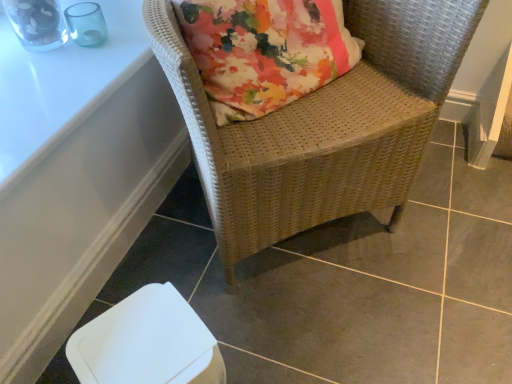
Question: Can you confirm if white plastic table at lower left, the 2th table when ordered from top to bottom, is wider than white glossy table at upper left, arranged as the first table when viewed from the top?

Choices:
 (A) no
 (B) yes

Answer: (A)

Question: Is white plastic table at lower left, positioned as the first table in bottom-to-top order, behind white glossy table at upper left, arranged as the first table when viewed from the top?

Choices:
 (A) yes
 (B) no

Answer: (A)

Question: Is white plastic table at lower left, positioned as the first table in bottom-to-top order, at the left side of white glossy table at upper left, arranged as the first table when viewed from the top?

Choices:
 (A) yes
 (B) no

Answer: (B)

Question: Is white plastic table at lower left, the 2th table when ordered from top to bottom, looking in the opposite direction of white glossy table at upper left, arranged as the first table when viewed from the top?

Choices:
 (A) yes
 (B) no

Answer: (B)

Question: Is white glossy table at upper left, arranged as the first table when viewed from the top, located within white plastic table at lower left, the 2th table when ordered from top to bottom?

Choices:
 (A) no
 (B) yes

Answer: (A)

Question: Considering the relative sizes of white plastic table at lower left, positioned as the first table in bottom-to-top order, and white glossy table at upper left, arranged as the first table when viewed from the top, in the image provided, is white plastic table at lower left, positioned as the first table in bottom-to-top order, bigger than white glossy table at upper left, arranged as the first table when viewed from the top,?

Choices:
 (A) yes
 (B) no

Answer: (B)

Question: Can you confirm if white plastic table at lower left, the 2th table when ordered from top to bottom, is shorter than white plastic swivel chair at lower left?

Choices:
 (A) no
 (B) yes

Answer: (B)

Question: Considering the relative sizes of white plastic table at lower left, the 2th table when ordered from top to bottom, and white plastic swivel chair at lower left in the image provided, is white plastic table at lower left, the 2th table when ordered from top to bottom, thinner than white plastic swivel chair at lower left?

Choices:
 (A) no
 (B) yes

Answer: (B)

Question: Is white plastic table at lower left, the 2th table when ordered from top to bottom, positioned far away from white plastic swivel chair at lower left?

Choices:
 (A) no
 (B) yes

Answer: (A)

Question: Considering the relative sizes of white plastic table at lower left, positioned as the first table in bottom-to-top order, and white plastic swivel chair at lower left in the image provided, is white plastic table at lower left, positioned as the first table in bottom-to-top order, taller than white plastic swivel chair at lower left?

Choices:
 (A) yes
 (B) no

Answer: (B)

Question: Can you confirm if white plastic table at lower left, the 2th table when ordered from top to bottom, is positioned to the right of white plastic swivel chair at lower left?

Choices:
 (A) no
 (B) yes

Answer: (A)

Question: Is white plastic table at lower left, positioned as the first table in bottom-to-top order, outside white plastic swivel chair at lower left?

Choices:
 (A) yes
 (B) no

Answer: (A)

Question: Is white glossy table at upper left, the 2th table when ordered from bottom to top, further to camera compared to white plastic swivel chair at lower left?

Choices:
 (A) no
 (B) yes

Answer: (B)